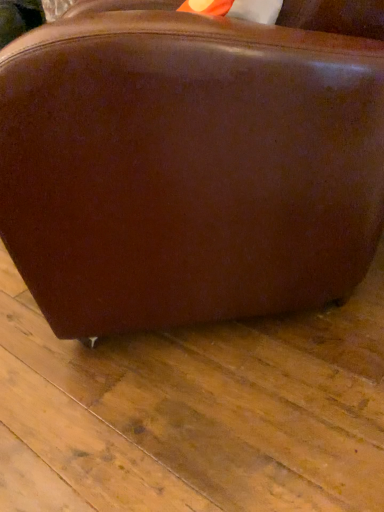
Measure the distance between point (216, 177) and camera.

Point (216, 177) and camera are 28.62 inches apart from each other.

Where is `brown leather suitcase at center`? The height and width of the screenshot is (512, 384). brown leather suitcase at center is located at coordinates (187, 166).

In order to face brown leather suitcase at center, should I rotate leftwards or rightwards?

Rotate right and turn 0.064 degrees.

The height and width of the screenshot is (512, 384). Describe the element at coordinates (187, 166) in the screenshot. I see `brown leather suitcase at center` at that location.

Find the location of `brown leather suitcase at center`. brown leather suitcase at center is located at coordinates (187, 166).